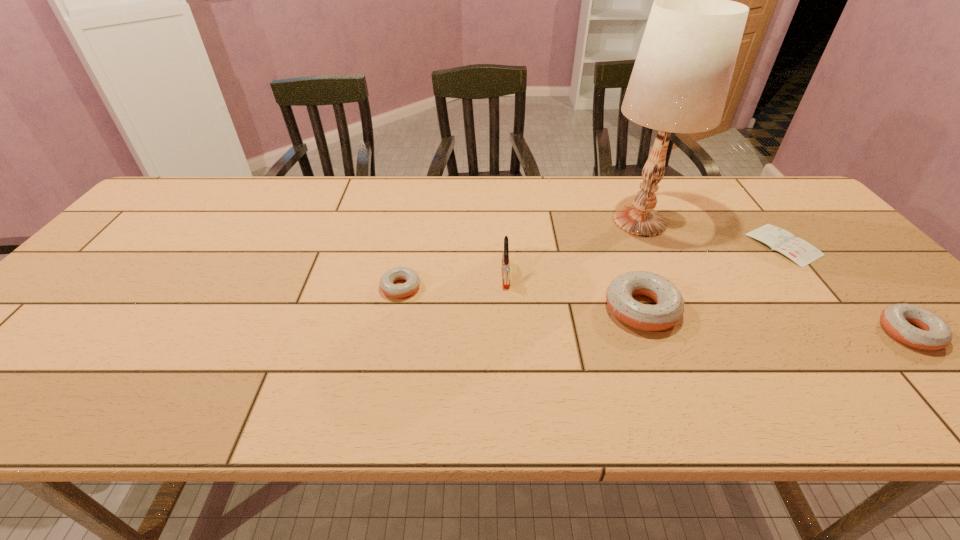
In order to click on vacant position located 0.160m on the back of the leftmost object in this screenshot , I will do `click(411, 237)`.

This screenshot has width=960, height=540. What are the coordinates of `free space located 0.270m on the back of the third tallest object` in the screenshot? It's located at (609, 222).

You are a GUI agent. You are given a task and a screenshot of the screen. Output one action in this format:
    pyautogui.click(x=<x>, y=<y>)
    Task: Click on the blank space located on the left of the rightmost doughnut
    
    Given the screenshot: What is the action you would take?
    pyautogui.click(x=801, y=333)

Locate an element on the screen. The image size is (960, 540). vacant space located 0.050m on the left of the shortest object is located at coordinates (734, 245).

Locate an element on the screen. This screenshot has height=540, width=960. vacant space situated 0.270m on the left of the lamp is located at coordinates (509, 221).

The width and height of the screenshot is (960, 540). Identify the location of free space located on the handle side of the stapler. (511, 356).

Where is `object at the far edge`? This screenshot has height=540, width=960. object at the far edge is located at coordinates (681, 77).

Find the location of a particular element. The height and width of the screenshot is (540, 960). object that is at the near edge is located at coordinates (934, 334).

Identify the location of doughnut situated at the right edge. (934, 334).

Identify the location of diary present at the right edge. The image size is (960, 540). (798, 250).